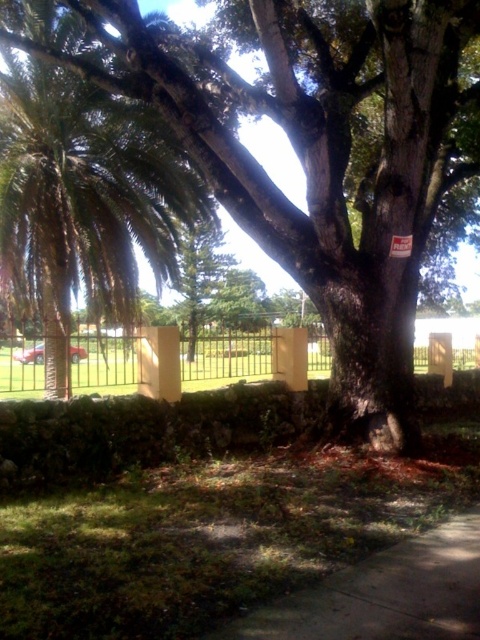
Does point (268, 42) lie behind point (36, 346)?

No, it is in front of (36, 346).

Does green rough bark tree at center come behind metallic silver fence at center?

No, green rough bark tree at center is in front of metallic silver fence at center.

You are a GUI agent. You are given a task and a screenshot of the screen. Output one action in this format:
    pyautogui.click(x=<x>, y=<y>)
    Task: Click on the green rough bark tree at center
    
    Given the screenshot: What is the action you would take?
    pyautogui.click(x=314, y=156)

Between point (141, 129) and point (40, 371), which one is positioned behind?

The point (40, 371) is behind.

Which is above, green leafy palm tree at left or metallic silver fence at center?

Positioned higher is green leafy palm tree at left.

Measure the distance between point [41,163] and camera.

Point [41,163] is 9.19 meters away from camera.

You are a GUI agent. You are given a task and a screenshot of the screen. Output one action in this format:
    pyautogui.click(x=<x>, y=<y>)
    Task: Click on the green leafy palm tree at left
    
    Given the screenshot: What is the action you would take?
    pyautogui.click(x=84, y=200)

Does green rough bark tree at center appear under green leafy palm tree at left?

No.

The image size is (480, 640). Identify the location of green rough bark tree at center. (314, 156).

At what (x,y) coordinates should I click in order to perform the action: click on green rough bark tree at center. Please return your answer as a coordinate pair (x, y). Looking at the image, I should click on (314, 156).